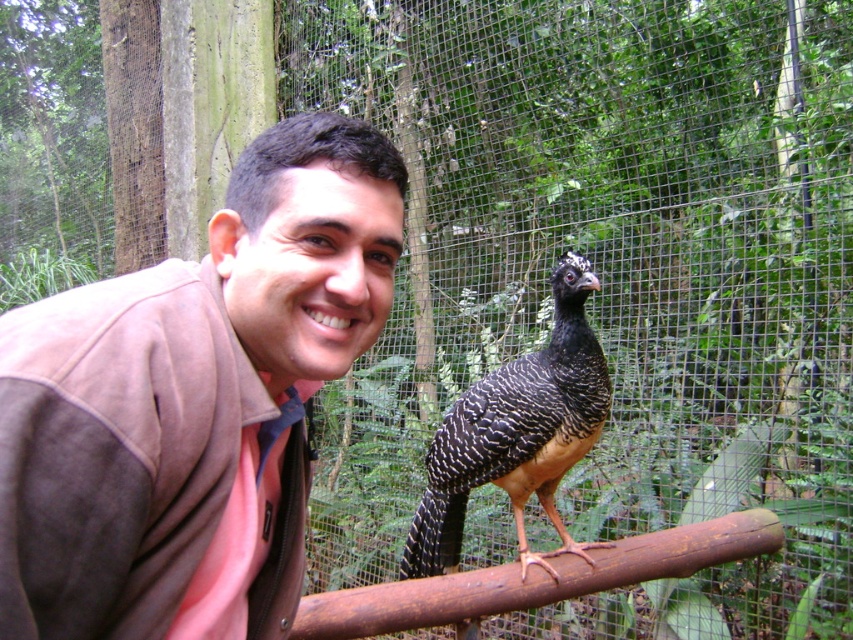
Between brown suede jacket at upper left and black glossy bird at center, which one has more height?

black glossy bird at center

This screenshot has width=853, height=640. What do you see at coordinates (193, 403) in the screenshot?
I see `brown suede jacket at upper left` at bounding box center [193, 403].

Locate an element on the screen. brown suede jacket at upper left is located at coordinates (193, 403).

Can you confirm if black glossy bird at center is positioned to the left of rusty metal rail at center?

Correct, you'll find black glossy bird at center to the left of rusty metal rail at center.

From the picture: Does black glossy bird at center appear over rusty metal rail at center?

Correct, black glossy bird at center is located above rusty metal rail at center.

At what (x,y) coordinates should I click in order to perform the action: click on black glossy bird at center. Please return your answer as a coordinate pair (x, y). This screenshot has width=853, height=640. Looking at the image, I should click on (515, 435).

The height and width of the screenshot is (640, 853). What are the coordinates of `black glossy bird at center` in the screenshot? It's located at (515, 435).

Which is behind, point (334, 124) or point (666, 561)?

Point (666, 561)

Is point (218, 392) positioned behind point (555, 561)?

No, it is in front of (555, 561).

This screenshot has height=640, width=853. In order to click on brown suede jacket at upper left in this screenshot , I will do [193, 403].